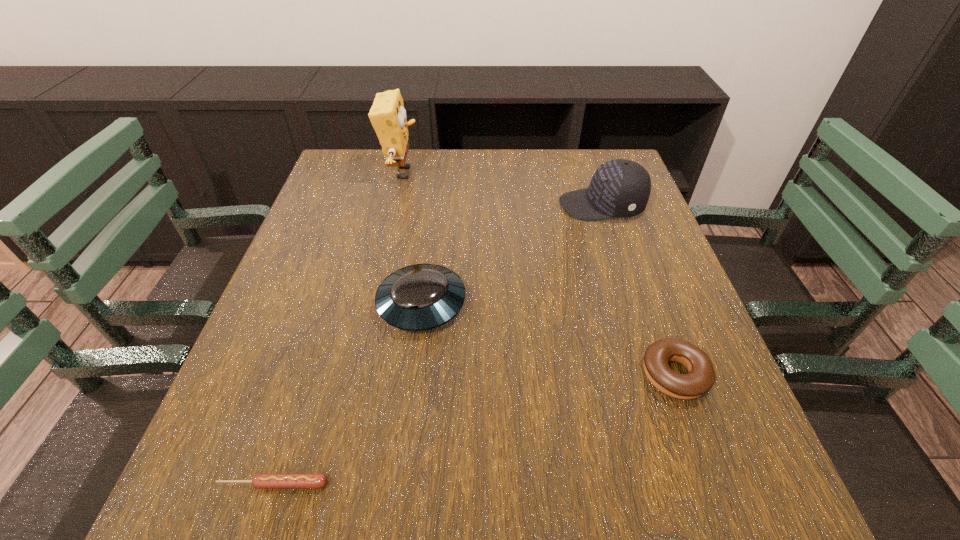
You are a GUI agent. You are given a task and a screenshot of the screen. Output one action in this format:
    pyautogui.click(x=<x>, y=<y>)
    Task: Click on the sponge
    The width and height of the screenshot is (960, 540).
    Given the screenshot: What is the action you would take?
    click(x=387, y=115)

Identify the location of baseball cap. The image size is (960, 540). (620, 188).

Image resolution: width=960 pixels, height=540 pixels. Find the location of `the third tallest object`. the third tallest object is located at coordinates (418, 297).

What are the coordinates of `the third nearest object` in the screenshot? It's located at (418, 297).

The image size is (960, 540). In order to click on the second nearest object in this screenshot , I will do `click(700, 378)`.

Image resolution: width=960 pixels, height=540 pixels. Find the location of `doughnut`. doughnut is located at coordinates (700, 378).

Locate an element on the screen. sausage is located at coordinates (260, 481).

The width and height of the screenshot is (960, 540). I want to click on the nearest object, so click(x=260, y=481).

Identify the location of free spot located 0.370m on the face of the sponge. (553, 173).

You are a GUI agent. You are given a task and a screenshot of the screen. Output one action in this format:
    pyautogui.click(x=<x>, y=<y>)
    Task: Click on the free space located 0.380m at the front of the baseball cap where the brim is located
    
    Given the screenshot: What is the action you would take?
    pyautogui.click(x=410, y=206)